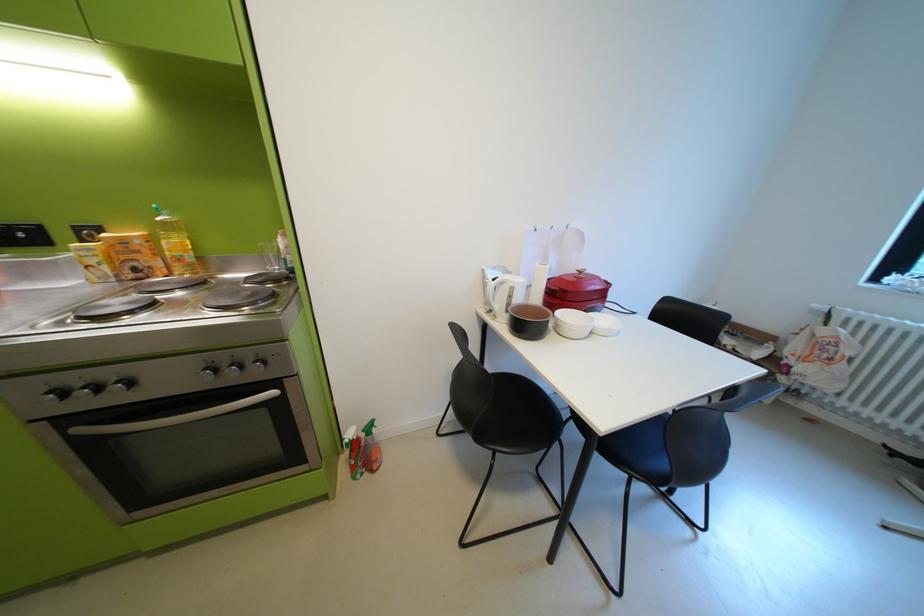
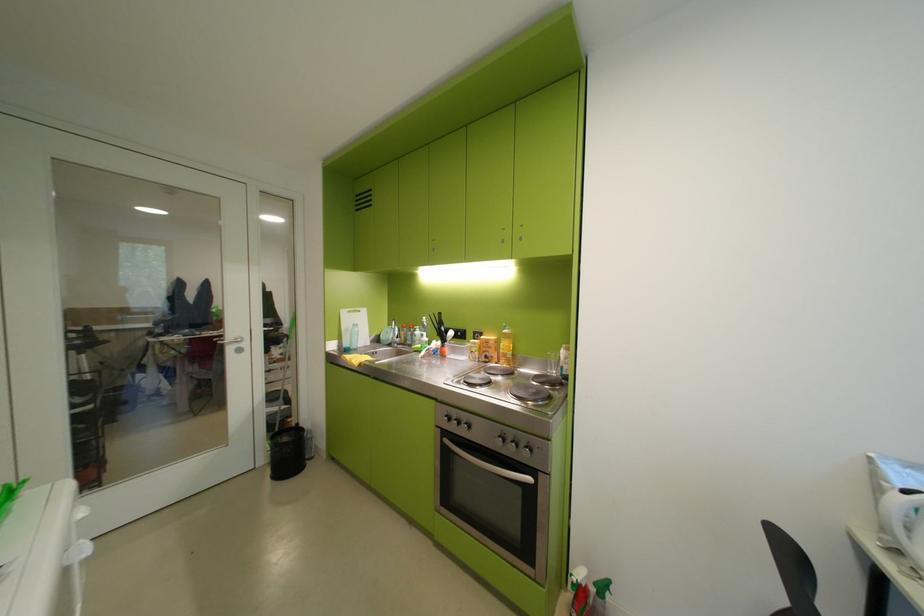
Find the pixel in the second image that matches the point at 273,261 in the first image.

(556, 363)